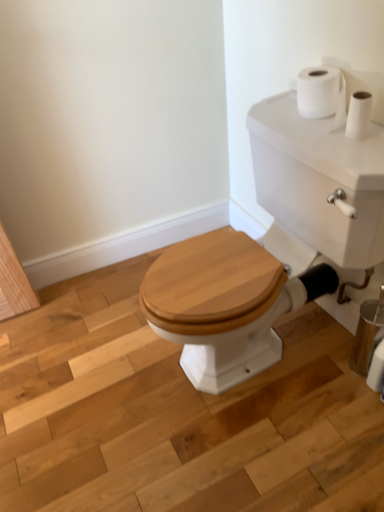
Question: Does white matte toilet paper at upper right, the first toilet paper positioned from the left, have a larger size compared to wooden toilet seat at center?

Choices:
 (A) no
 (B) yes

Answer: (A)

Question: Considering the relative positions of white matte toilet paper at upper right, the second toilet paper in the bottom-to-top sequence, and wooden toilet seat at center in the image provided, is white matte toilet paper at upper right, the second toilet paper in the bottom-to-top sequence, to the right of wooden toilet seat at center from the viewer's perspective?

Choices:
 (A) yes
 (B) no

Answer: (A)

Question: Does white matte toilet paper at upper right, arranged as the first toilet paper when viewed from the top, have a lesser height compared to wooden toilet seat at center?

Choices:
 (A) yes
 (B) no

Answer: (B)

Question: From a real-world perspective, does white matte toilet paper at upper right, the first toilet paper positioned from the left, sit lower than wooden toilet seat at center?

Choices:
 (A) no
 (B) yes

Answer: (A)

Question: Is white matte toilet paper at upper right, arranged as the first toilet paper when viewed from the top, facing away from wooden toilet seat at center?

Choices:
 (A) no
 (B) yes

Answer: (A)

Question: Is wooden toilet seat at center inside white matte toilet paper at upper right, acting as the second toilet paper starting from the right?

Choices:
 (A) yes
 (B) no

Answer: (B)

Question: Is the position of white matte toilet paper at upper right, arranged as the first toilet paper when viewed from the top, more distant than that of white matte toilet paper at upper right, the first toilet paper when ordered from bottom to top?

Choices:
 (A) no
 (B) yes

Answer: (A)

Question: Does white matte toilet paper at upper right, the first toilet paper positioned from the left, appear on the left side of white matte toilet paper at upper right, the 1th toilet paper when ordered from right to left?

Choices:
 (A) no
 (B) yes

Answer: (B)

Question: Is white matte toilet paper at upper right, the second toilet paper in the bottom-to-top sequence, facing away from white matte toilet paper at upper right, the first toilet paper when ordered from bottom to top?

Choices:
 (A) yes
 (B) no

Answer: (B)

Question: Is white matte toilet paper at upper right, marked as the 2th toilet paper in a left-to-right arrangement, completely or partially inside white matte toilet paper at upper right, arranged as the first toilet paper when viewed from the top?

Choices:
 (A) yes
 (B) no

Answer: (B)

Question: From a real-world perspective, is white matte toilet paper at upper right, arranged as the first toilet paper when viewed from the top, located higher than white matte toilet paper at upper right, which is the second toilet paper in top-to-bottom order?

Choices:
 (A) yes
 (B) no

Answer: (A)

Question: Could you tell me if white matte toilet paper at upper right, arranged as the first toilet paper when viewed from the top, is turned towards white matte toilet paper at upper right, the 1th toilet paper when ordered from right to left?

Choices:
 (A) no
 (B) yes

Answer: (A)

Question: Considering the relative positions of white glossy porcelain at center and white matte toilet paper at upper right, marked as the 2th toilet paper in a left-to-right arrangement, in the image provided, is white glossy porcelain at center to the right of white matte toilet paper at upper right, marked as the 2th toilet paper in a left-to-right arrangement, from the viewer's perspective?

Choices:
 (A) no
 (B) yes

Answer: (A)